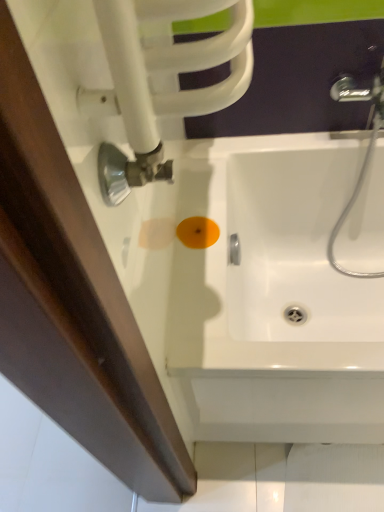
Where is `white glossy sink at center`? The width and height of the screenshot is (384, 512). white glossy sink at center is located at coordinates 271,264.

Measure the distance between point (x=363, y=297) and camera.

Point (x=363, y=297) and camera are 4.32 feet apart.

The height and width of the screenshot is (512, 384). What do you see at coordinates (271, 264) in the screenshot? I see `white glossy sink at center` at bounding box center [271, 264].

Locate an element on the screen. The width and height of the screenshot is (384, 512). white glossy sink at center is located at coordinates (271, 264).